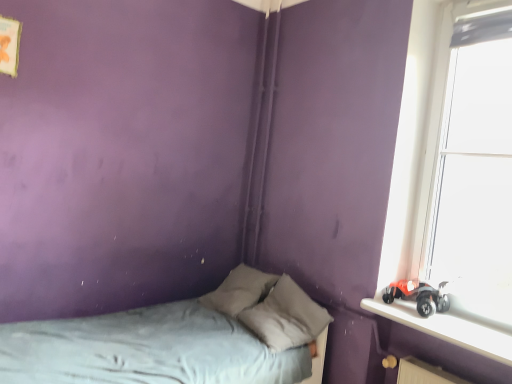
Question: From the image's perspective, is transparent glass window at right on gray fabric bed at lower left?

Choices:
 (A) yes
 (B) no

Answer: (A)

Question: Is transparent glass window at right not inside gray fabric bed at lower left?

Choices:
 (A) no
 (B) yes

Answer: (B)

Question: From a real-world perspective, is transparent glass window at right under gray fabric bed at lower left?

Choices:
 (A) yes
 (B) no

Answer: (B)

Question: Does transparent glass window at right contain gray fabric bed at lower left?

Choices:
 (A) yes
 (B) no

Answer: (B)

Question: Is transparent glass window at right looking in the opposite direction of gray fabric bed at lower left?

Choices:
 (A) yes
 (B) no

Answer: (B)

Question: Considering the positions of transparent glass window at right and smooth plastic toy car at right in the image, is transparent glass window at right taller or shorter than smooth plastic toy car at right?

Choices:
 (A) tall
 (B) short

Answer: (A)

Question: Considering the positions of transparent glass window at right and smooth plastic toy car at right in the image, is transparent glass window at right wider or thinner than smooth plastic toy car at right?

Choices:
 (A) wide
 (B) thin

Answer: (B)

Question: Considering the relative positions of transparent glass window at right and smooth plastic toy car at right in the image provided, is transparent glass window at right to the left or to the right of smooth plastic toy car at right?

Choices:
 (A) left
 (B) right

Answer: (B)

Question: Looking at the image, does transparent glass window at right seem bigger or smaller compared to smooth plastic toy car at right?

Choices:
 (A) big
 (B) small

Answer: (A)

Question: Considering the relative positions of gray fabric pillow at center and gray fabric bed at lower left in the image provided, is gray fabric pillow at center to the left or to the right of gray fabric bed at lower left?

Choices:
 (A) left
 (B) right

Answer: (B)

Question: Considering the positions of gray fabric pillow at center and gray fabric bed at lower left in the image, is gray fabric pillow at center bigger or smaller than gray fabric bed at lower left?

Choices:
 (A) small
 (B) big

Answer: (A)

Question: Considering the positions of gray fabric pillow at center and gray fabric bed at lower left in the image, is gray fabric pillow at center wider or thinner than gray fabric bed at lower left?

Choices:
 (A) wide
 (B) thin

Answer: (B)

Question: Do you think gray fabric pillow at center is within gray fabric bed at lower left, or outside of it?

Choices:
 (A) inside
 (B) outside

Answer: (A)

Question: Is smooth plastic toy car at right situated inside gray fabric bed at lower left or outside?

Choices:
 (A) outside
 (B) inside

Answer: (A)

Question: From a real-world perspective, is smooth plastic toy car at right physically located above or below gray fabric bed at lower left?

Choices:
 (A) below
 (B) above

Answer: (B)